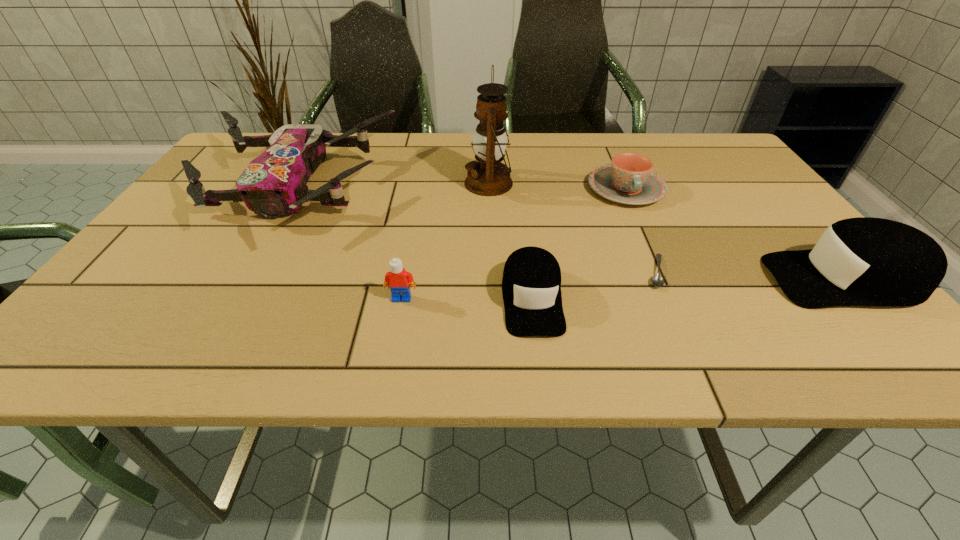
Where is `free space located on the front-facing side of the rightmost object`? free space located on the front-facing side of the rightmost object is located at coordinates (715, 279).

Where is `free space located on the handle side of the chinaware`? The width and height of the screenshot is (960, 540). free space located on the handle side of the chinaware is located at coordinates (651, 244).

The height and width of the screenshot is (540, 960). Find the location of `free space located on the front-facing side of the leftmost object`. free space located on the front-facing side of the leftmost object is located at coordinates (248, 264).

Locate an element on the screen. The image size is (960, 540). free space located on the right of the soupspoon is located at coordinates (746, 272).

I want to click on free space located on the side of the lantern, there is a wick adjustment knob, so click(x=392, y=183).

Find the location of `vacant space located 0.080m on the side of the lantern, there is a wick adjustment knob`. vacant space located 0.080m on the side of the lantern, there is a wick adjustment knob is located at coordinates (434, 183).

Image resolution: width=960 pixels, height=540 pixels. I want to click on vacant space situated on the side of the lantern, there is a wick adjustment knob, so click(377, 183).

You are a GUI agent. You are given a task and a screenshot of the screen. Output one action in this format:
    pyautogui.click(x=<x>, y=<y>)
    Task: Click on the chinaware located at the far edge
    
    Given the screenshot: What is the action you would take?
    pyautogui.click(x=629, y=179)

In order to click on drone present at the far edge in this screenshot , I will do `click(274, 184)`.

The image size is (960, 540). I want to click on lantern that is at the far edge, so click(488, 177).